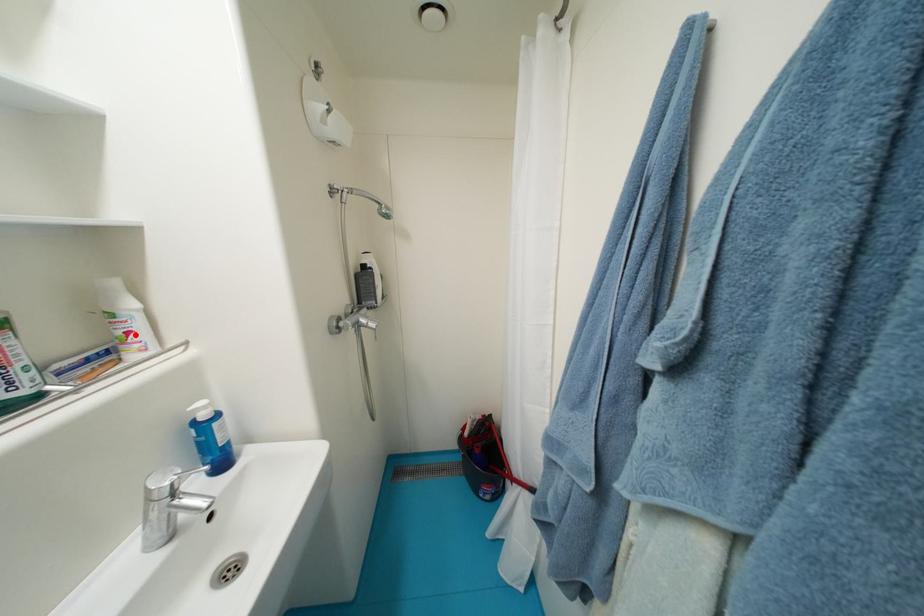
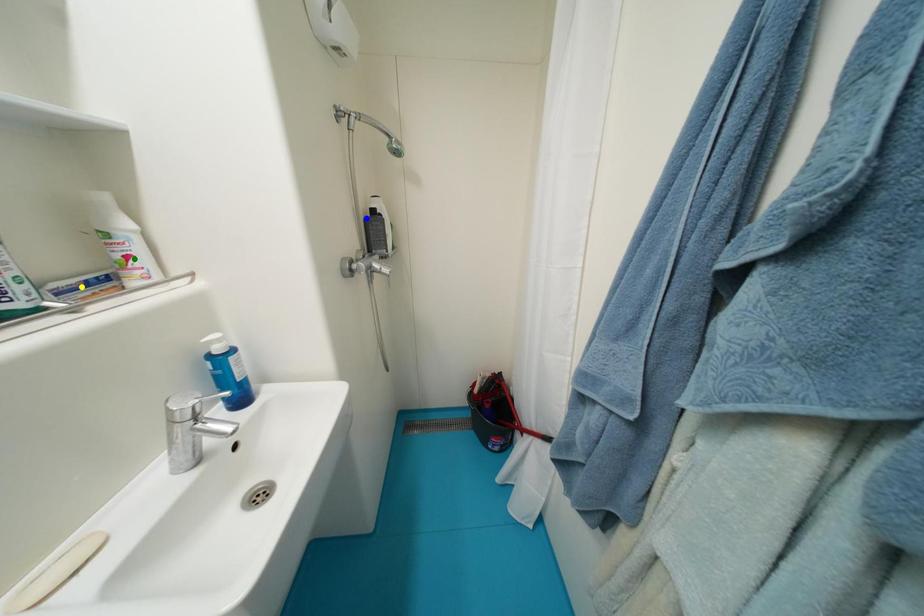
Question: I am providing you with two images of the same scene from different viewpoints. A red point is marked on the first image. You are given multiple points on the second image. Which mark in image 2 goes with the point in image 1?

Choices:
 (A) blue point
 (B) green point
 (C) yellow point

Answer: (B)